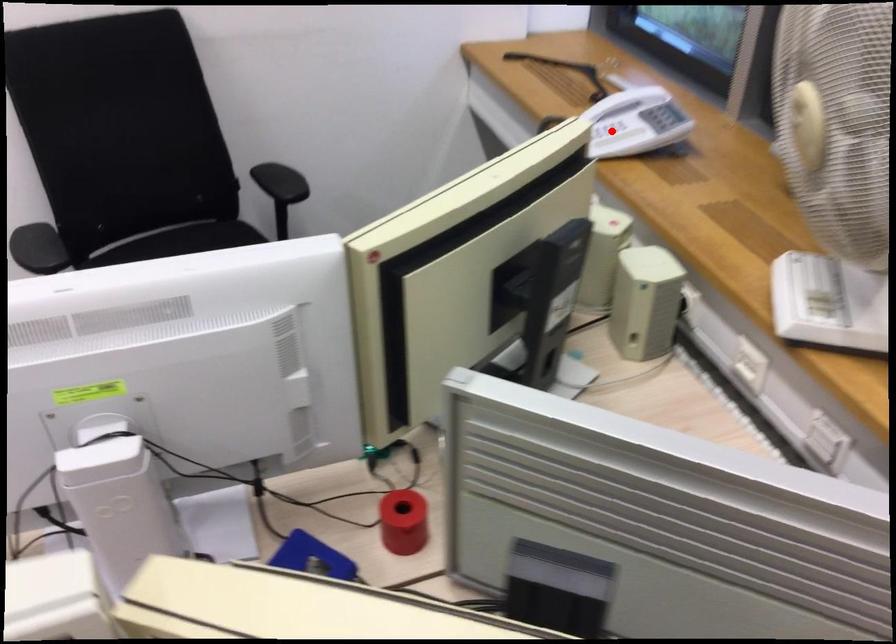
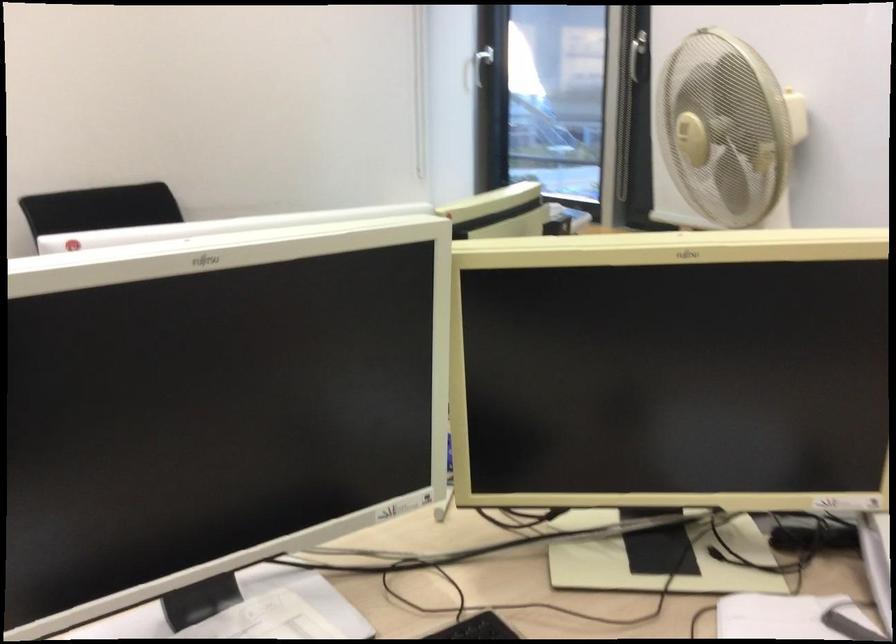
Question: I am providing you with two images of the same scene from different viewpoints. A red point is marked on the first image. Can you still see the location of the red point in image 2?

Choices:
 (A) Yes
 (B) No

Answer: (B)